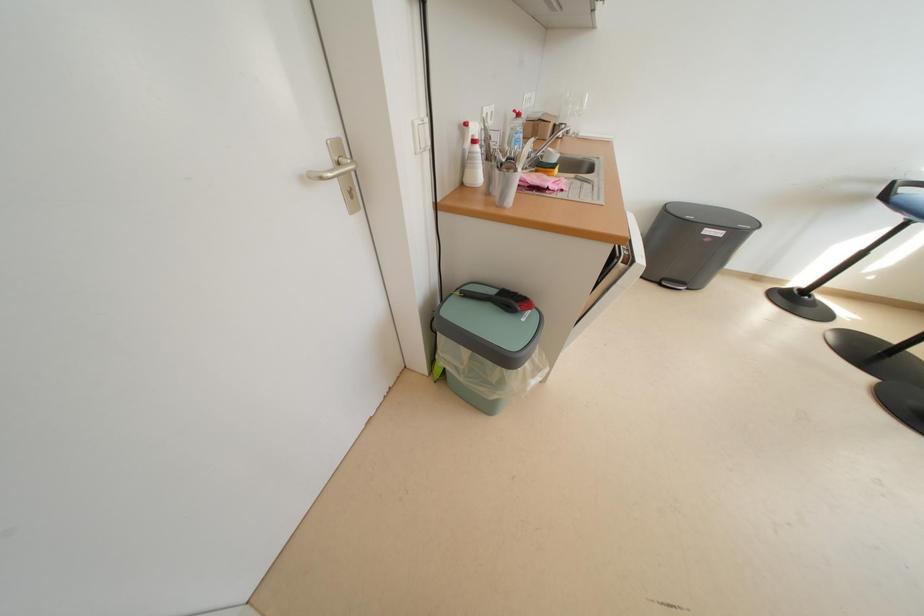
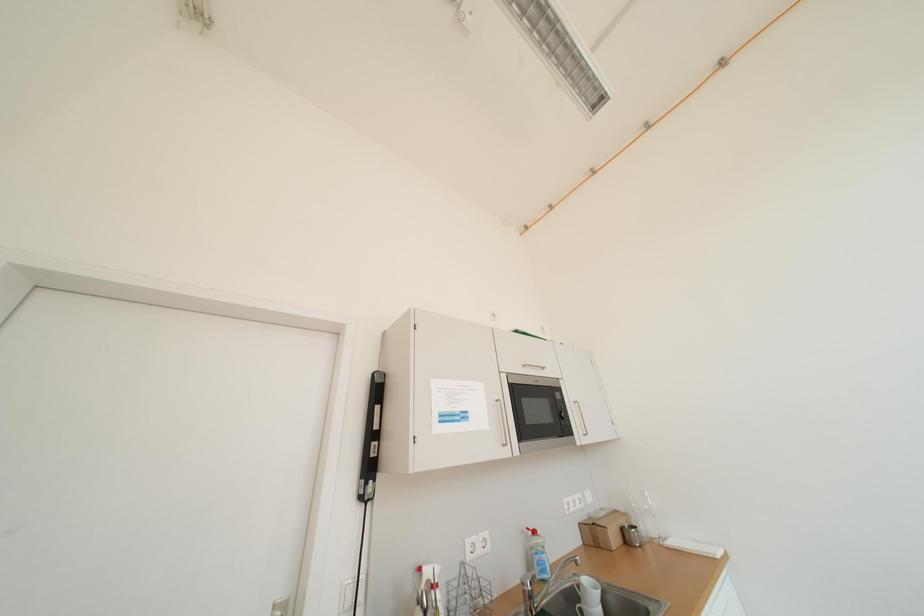
First-person continuous shooting, in which direction is the camera rotating?

The rotation direction of the camera is left-up.